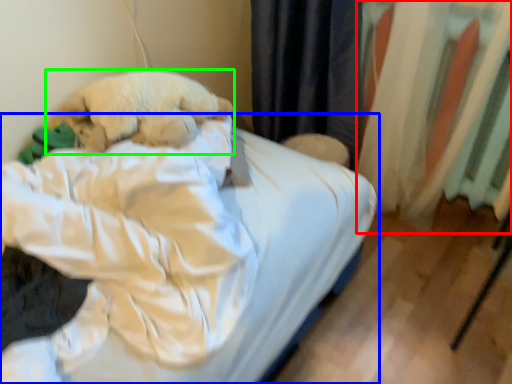
Question: Which object is the farthest from curtain (highlighted by a red box)? Choose among these: bed (highlighted by a blue box) or dog (highlighted by a green box).

Choices:
 (A) bed
 (B) dog

Answer: (B)